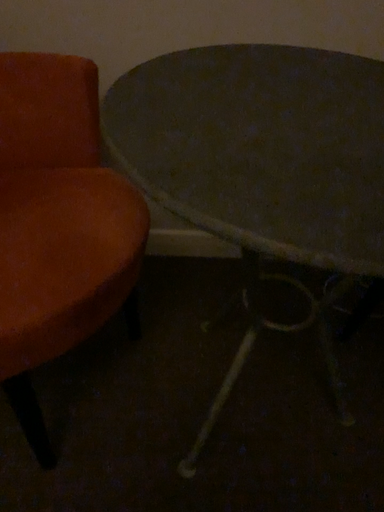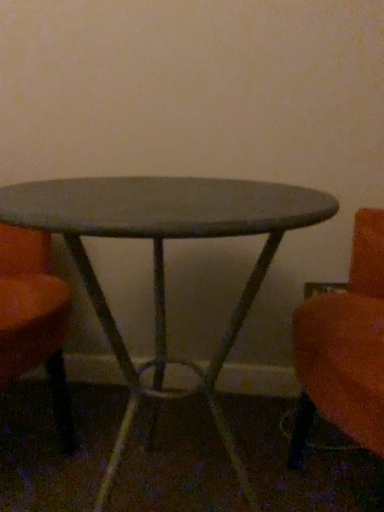
Question: How did the camera likely rotate when shooting the video?

Choices:
 (A) rotated downward
 (B) rotated upward

Answer: (B)